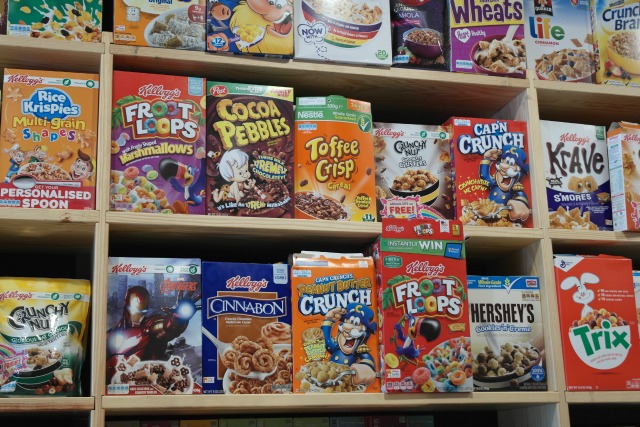
At what (x,y) coordinates should I click in order to perform the action: click on boxes of cereal on the second lowest shelf. Please return your answer as a coordinate pair (x, y). Looking at the image, I should click on [43, 348], [141, 342], [251, 328], [342, 337], [424, 337], [493, 348], [593, 339], [636, 286].